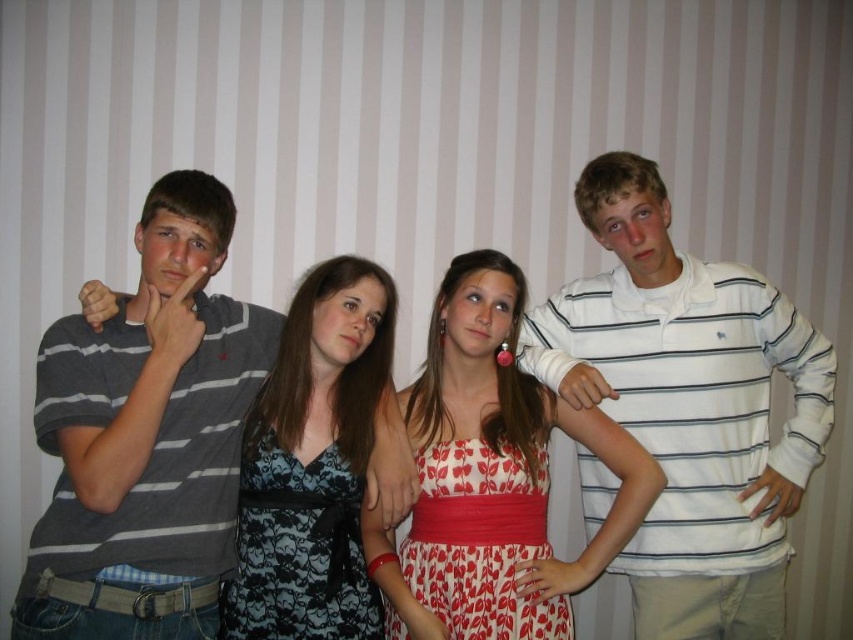
Question: Is white striped polo shirt at right wider than dark blue floral dress at center?

Choices:
 (A) no
 (B) yes

Answer: (B)

Question: Which point is closer to the camera?

Choices:
 (A) (426, 378)
 (B) (635, 154)
 (C) (369, 637)
 (D) (59, 598)

Answer: (D)

Question: Is the position of gray striped shirt at left less distant than that of printed cotton dress at center?

Choices:
 (A) yes
 (B) no

Answer: (A)

Question: Which of the following is the farthest from the observer?

Choices:
 (A) printed cotton dress at center
 (B) dark blue floral dress at center
 (C) gray striped shirt at left
 (D) white striped polo shirt at right

Answer: (D)

Question: Can you confirm if white striped polo shirt at right is wider than gray striped shirt at left?

Choices:
 (A) yes
 (B) no

Answer: (A)

Question: Which point appears farthest from the camera in this image?

Choices:
 (A) (213, 339)
 (B) (581, 209)
 (C) (339, 544)
 (D) (592, 433)

Answer: (B)